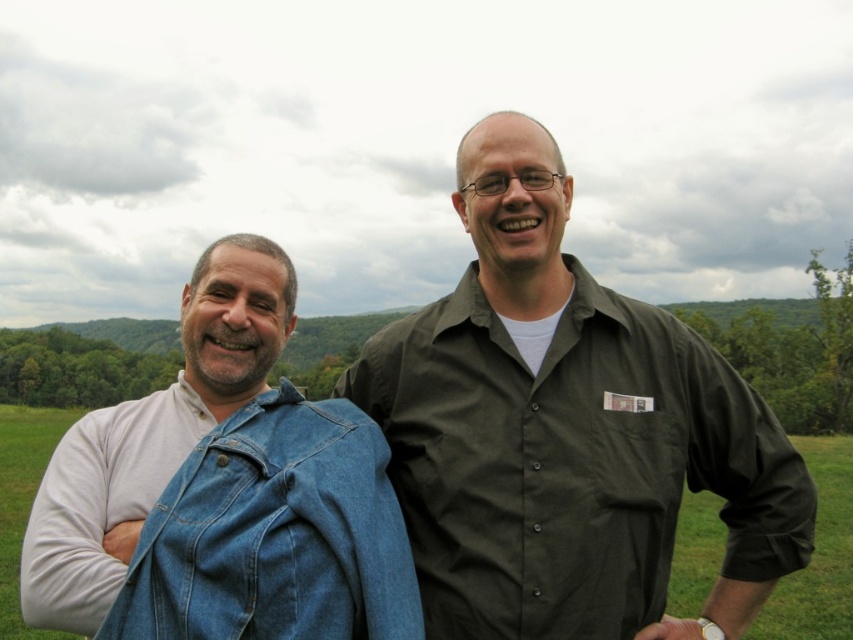
Question: Is matte green shirt at center positioned at the back of faded denim jacket at lower right?

Choices:
 (A) no
 (B) yes

Answer: (B)

Question: Which of the following is the farthest from the observer?

Choices:
 (A) faded denim jacket at lower right
 (B) matte green shirt at center

Answer: (B)

Question: Among these objects, which one is farthest from the camera?

Choices:
 (A) faded denim jacket at lower right
 (B) matte green shirt at center

Answer: (B)

Question: Is matte green shirt at center above faded denim jacket at lower right?

Choices:
 (A) no
 (B) yes

Answer: (A)

Question: Can you confirm if matte green shirt at center is thinner than faded denim jacket at lower right?

Choices:
 (A) yes
 (B) no

Answer: (A)

Question: Which of the following is the closest to the observer?

Choices:
 (A) pyautogui.click(x=657, y=582)
 (B) pyautogui.click(x=286, y=528)

Answer: (B)